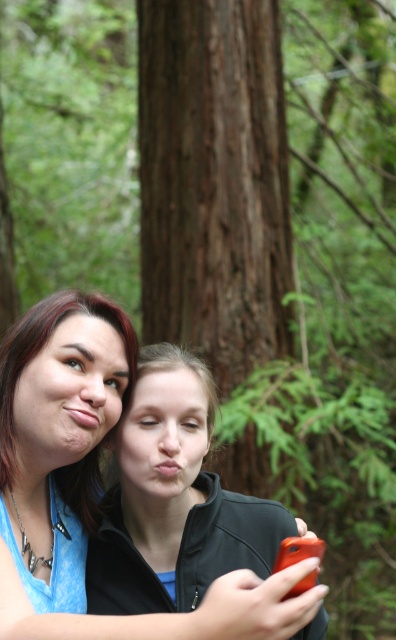
Question: Does brown rough tree trunk at center come behind matte blue shirt at lower left?

Choices:
 (A) no
 (B) yes

Answer: (B)

Question: Considering the real-world distances, which object is farthest from the matte blue shirt at lower left?

Choices:
 (A) matte blue shirt at left
 (B) brown rough tree trunk at center

Answer: (B)

Question: Which object is closer to the camera taking this photo?

Choices:
 (A) matte blue shirt at left
 (B) brown rough tree trunk at center
 (C) matte blue shirt at lower left

Answer: (C)

Question: Which point is closer to the camera?

Choices:
 (A) (224, 182)
 (B) (125, 392)

Answer: (B)

Question: Does matte blue shirt at lower left appear over matte blue shirt at left?

Choices:
 (A) yes
 (B) no

Answer: (B)

Question: Does brown rough tree trunk at center come in front of matte blue shirt at left?

Choices:
 (A) no
 (B) yes

Answer: (A)